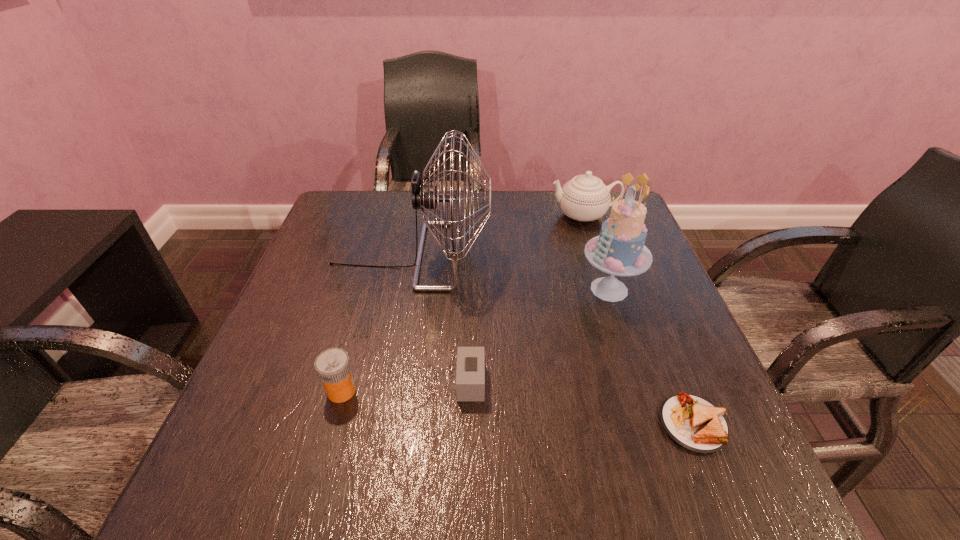
Where is `fan`? The image size is (960, 540). fan is located at coordinates (425, 196).

What are the coordinates of `cake` in the screenshot? It's located at (619, 250).

Image resolution: width=960 pixels, height=540 pixels. Find the location of `the fourth shortest object`. the fourth shortest object is located at coordinates (585, 197).

Image resolution: width=960 pixels, height=540 pixels. Find the location of `medicine`. medicine is located at coordinates 333,367.

Where is `alarm clock`? This screenshot has width=960, height=540. alarm clock is located at coordinates (470, 372).

Locate an element on the screen. The height and width of the screenshot is (540, 960). the shortest object is located at coordinates (693, 423).

Find the location of `vacant space located on the front-facing side of the fan`. vacant space located on the front-facing side of the fan is located at coordinates (650, 255).

Image resolution: width=960 pixels, height=540 pixels. What are the coordinates of `vacant space situated 0.320m with a ladder on the side of the cake` in the screenshot? It's located at 438,289.

Identify the location of vacant position located 0.180m with a ladder on the side of the cake. The width and height of the screenshot is (960, 540). (499, 289).

Find the location of a particular element. The width and height of the screenshot is (960, 540). vacant area situated 0.400m with a ladder on the side of the cake is located at coordinates (403, 289).